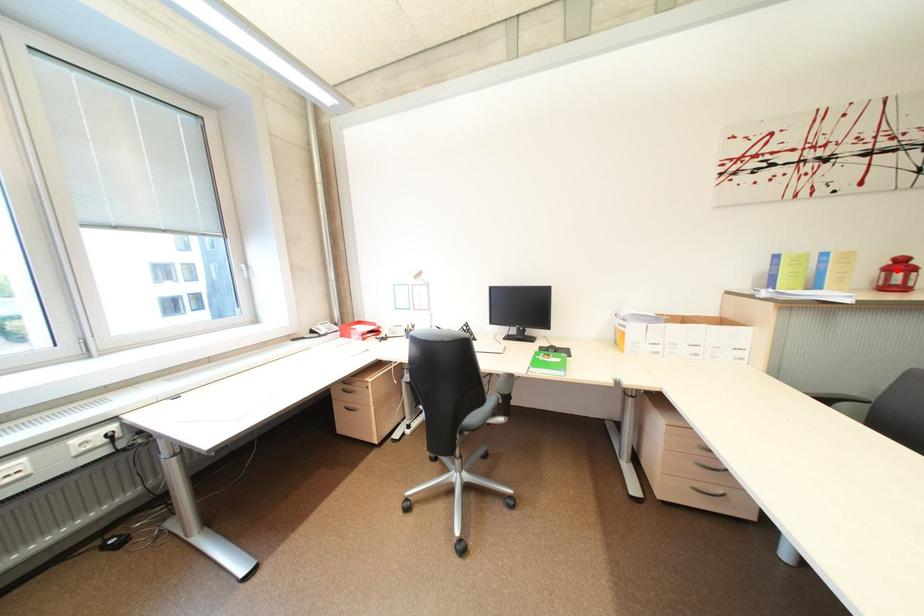
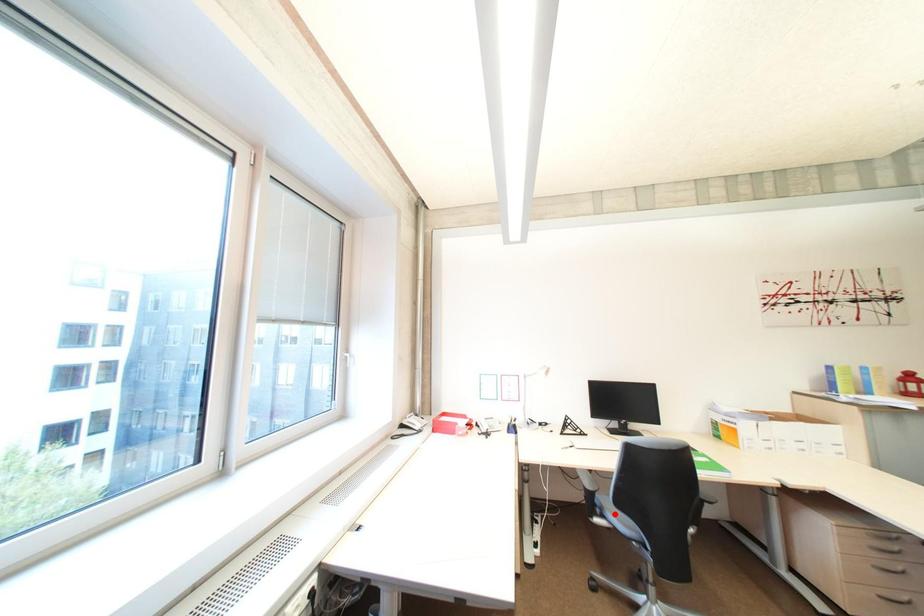
I am providing you with two images of the same scene from different viewpoints. A red point is marked on the first image and another point is marked on the second image. Does the point marked in image1 correspond to the same location as the one in image2?

No